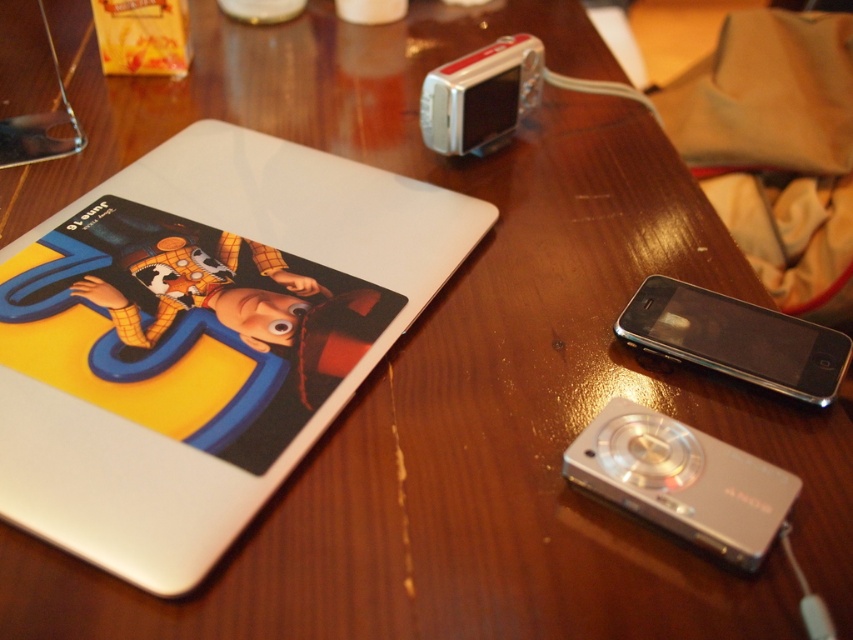
You need to place a new item on the table that is larger than the black glossy smartphone at right but smaller than the silver metallic camera at upper center. Is there enough space between them to fit this new item?

The black glossy smartphone at right is smaller than the silver metallic camera at upper center. Since the new item is larger than the smartphone but smaller than the camera, there is sufficient space between them to accommodate it.

You are standing at the edge of the table and want to place a small object on the glossy white laptop at upper left. Based on its 2D coordinates, where should you aim to place the object?

The glossy white laptop at upper left is located at point (201, 339), so you should aim for that coordinate to place the object.

You are a photographer who needs to place a new camera on the table. The table has a coordinate system where the bottom left corner is the origin point. The new camera must be placed at least 0.1 units away from the black glossy smartphone at right. Where can you place the new camera?

The black glossy smartphone at right is located at point (735, 339). To place the new camera at least 0.1 units away, ensure it is positioned outside the circle with a radius of 0.1 centered at (735, 339). This means the camera should be placed anywhere on the table except within the area defined by this radius.